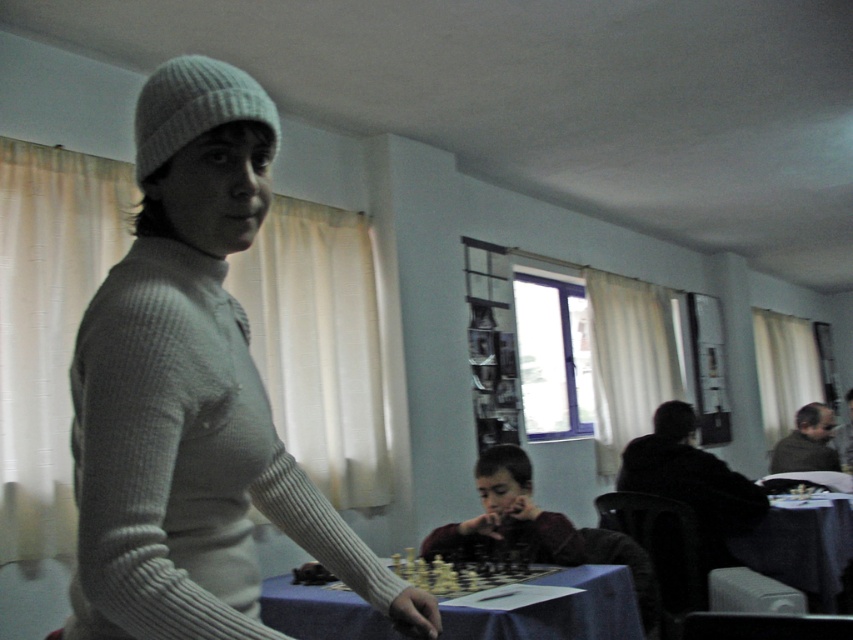
How far apart are white ribbed sweater at center and blue fabric table at center?

white ribbed sweater at center and blue fabric table at center are 4.20 feet apart.

Does white ribbed sweater at center appear under blue fabric table at center?

No, white ribbed sweater at center is not below blue fabric table at center.

Measure the distance between point (386, 589) and camera.

Point (386, 589) and camera are 3.75 feet apart from each other.

Locate an element on the screen. The width and height of the screenshot is (853, 640). white ribbed sweater at center is located at coordinates (193, 394).

Measure the distance from white ribbed sweater at center to dark red sweater at center.

The distance of white ribbed sweater at center from dark red sweater at center is 1.76 meters.

Between white ribbed sweater at center and dark red sweater at center, which one appears on the right side from the viewer's perspective?

From the viewer's perspective, dark red sweater at center appears more on the right side.

Who is more forward, (103, 472) or (548, 547)?

Positioned in front is point (103, 472).

The width and height of the screenshot is (853, 640). I want to click on white ribbed sweater at center, so click(193, 394).

Does blue fabric table at center lie in front of dark red sweater at center?

Yes, blue fabric table at center is closer to the viewer.

Which is behind, point (637, 627) or point (483, 548)?

The point (483, 548) is more distant.

Locate an element on the screen. This screenshot has height=640, width=853. blue fabric table at center is located at coordinates (558, 611).